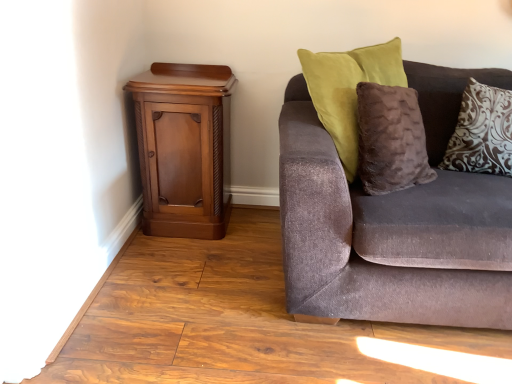
Locate an element on the screen. empty space that is to the right of mahogany wood cabinet at left is located at coordinates (253, 233).